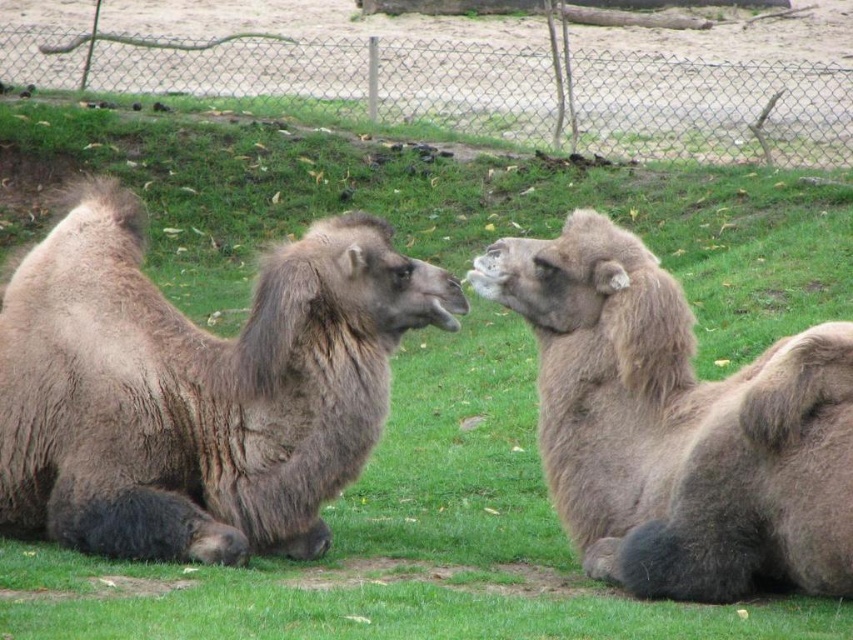
Measure the distance from brown fuzzy camel at left to wire mesh fence at upper center.

10.90 meters

Is brown fuzzy camel at left bigger than wire mesh fence at upper center?

No.

Who is more distant from viewer, (294,388) or (172,92)?

Point (172,92)

Locate an element on the screen. This screenshot has height=640, width=853. brown fuzzy camel at left is located at coordinates (196, 387).

Does point (581, 424) come behind point (799, 120)?

That is False.

Identify the location of fuzzy brown camel at center. This screenshot has height=640, width=853. (677, 426).

At what (x,y) coordinates should I click in order to perform the action: click on fuzzy brown camel at center. Please return your answer as a coordinate pair (x, y). This screenshot has height=640, width=853. Looking at the image, I should click on (677, 426).

At what (x,y) coordinates should I click in order to perform the action: click on fuzzy brown camel at center. Please return your answer as a coordinate pair (x, y). This screenshot has height=640, width=853. Looking at the image, I should click on pos(677,426).

Between brown fuzzy camel at left and fuzzy brown camel at center, which one is positioned lower?

fuzzy brown camel at center is below.

Does brown fuzzy camel at left have a greater width compared to fuzzy brown camel at center?

Correct, the width of brown fuzzy camel at left exceeds that of fuzzy brown camel at center.

Is point (158, 477) positioned after point (601, 483)?

No, it is not.

The width and height of the screenshot is (853, 640). Find the location of `brown fuzzy camel at left`. brown fuzzy camel at left is located at coordinates coord(196,387).